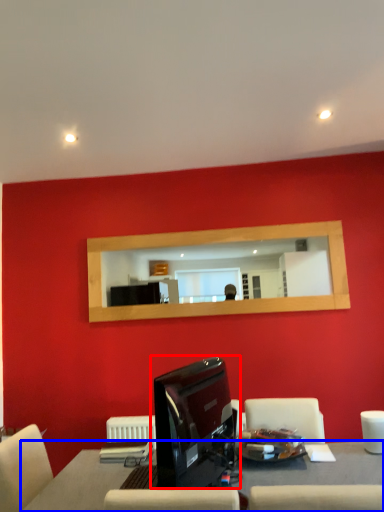
Question: Which of the following is the farthest to the observer, computer monitor (highlighted by a red box) or table (highlighted by a blue box)?

Choices:
 (A) computer monitor
 (B) table

Answer: (B)